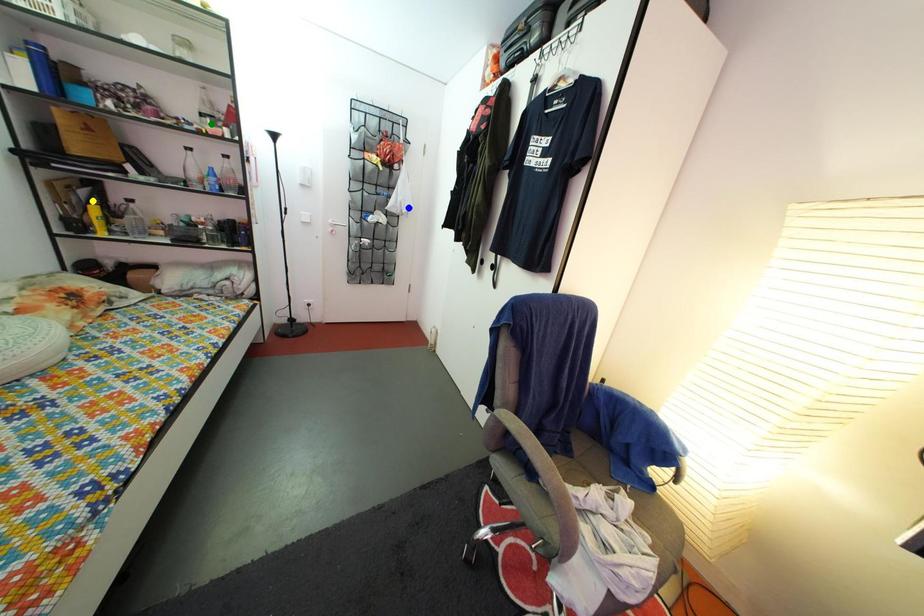
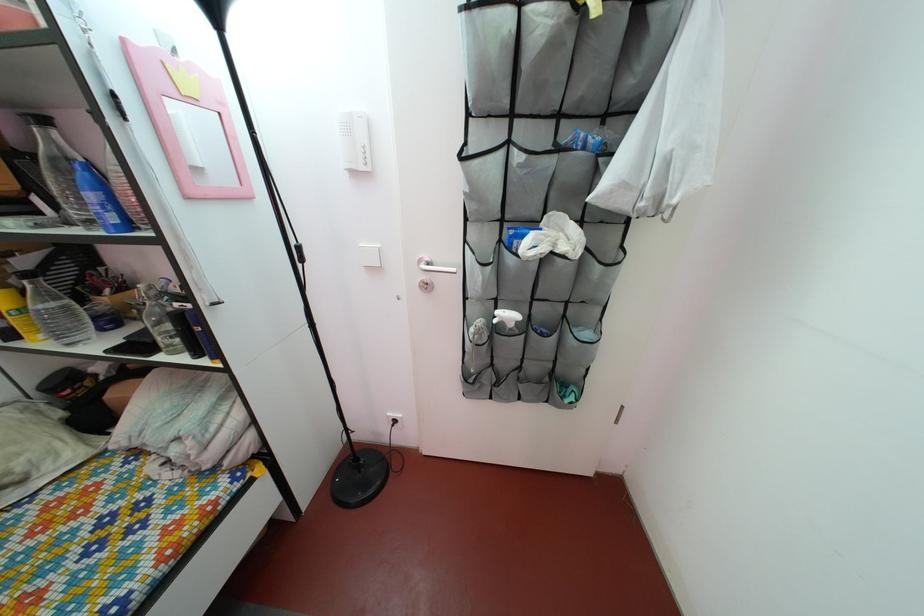
I am providing you with two images of the same scene from different viewpoints. Three points are marked in image1. Which point corresponds to a part or object that is occluded in image2?In image1, three points are marked. Which of them correspond to a part or object that is occluded in image2?Among the three points shown in image1, which one corresponds to a part or object that is no longer visible due to occlusion in image2?

green point